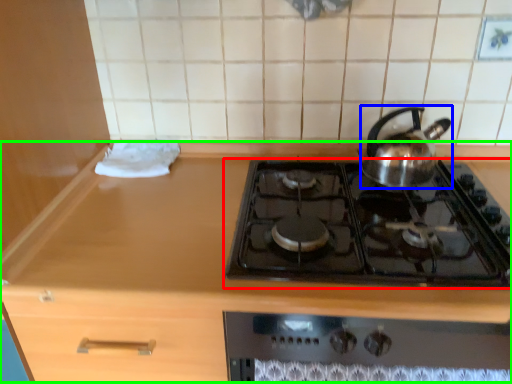
Question: Which object is the closest to the gas stove (highlighted by a red box)? Choose among these: kettle (highlighted by a blue box) or counter (highlighted by a green box).

Choices:
 (A) kettle
 (B) counter

Answer: (A)